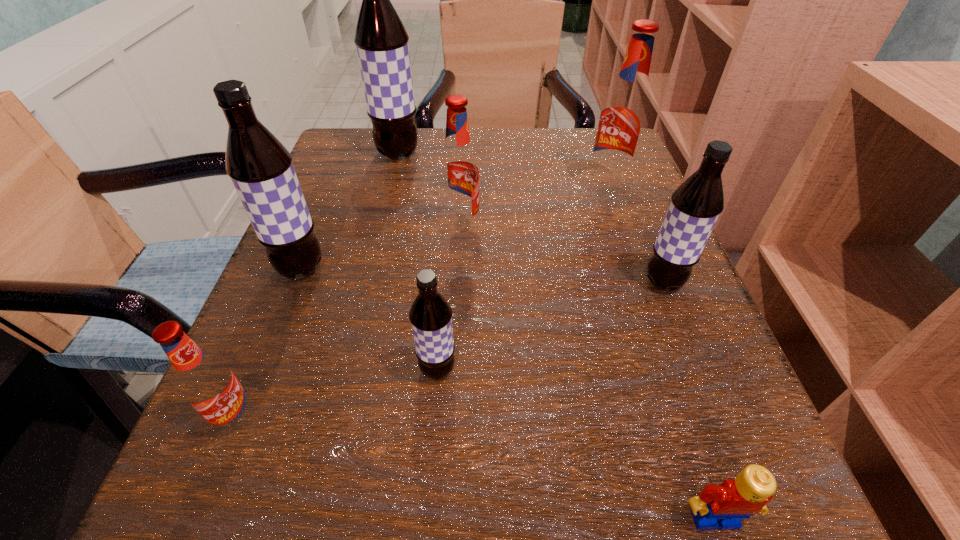
Where is `the biggest brown root beer`? The height and width of the screenshot is (540, 960). the biggest brown root beer is located at coordinates (381, 40).

Identify the location of the sixth object from right to left. (381, 40).

Where is `the sixth nearest root beer`? the sixth nearest root beer is located at coordinates (623, 119).

I want to click on the rightmost red root beer, so click(623, 119).

This screenshot has width=960, height=540. I want to click on the leftmost brown root beer, so click(x=260, y=167).

This screenshot has width=960, height=540. Find the location of `the second biggest red root beer`. the second biggest red root beer is located at coordinates (458, 169).

Identify the location of the sixth nearest object. (458, 169).

Identify the location of the third biggest brown root beer. This screenshot has width=960, height=540. (695, 206).

Locate an element on the screen. the leftmost red root beer is located at coordinates (207, 383).

You are a GUI agent. You are given a task and a screenshot of the screen. Output one action in this format:
    pyautogui.click(x=<x>, y=<y>)
    Task: Click on the nearest root beer
    
    Given the screenshot: What is the action you would take?
    pyautogui.click(x=207, y=383)